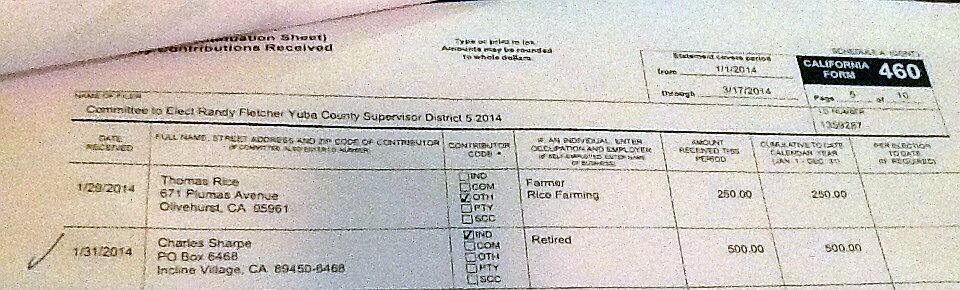
I want to click on document, so click(x=394, y=66).